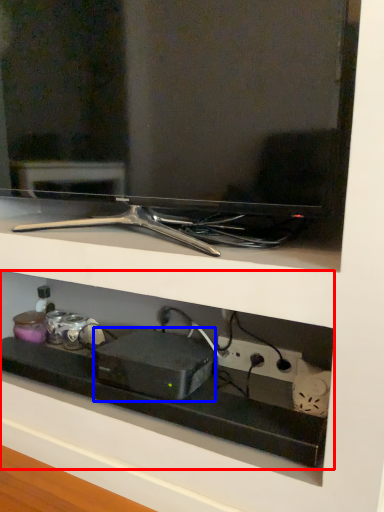
Question: Which point is closer to the camera, shelf (highlighted by a red box) or appliance (highlighted by a blue box)?

Choices:
 (A) shelf
 (B) appliance

Answer: (A)